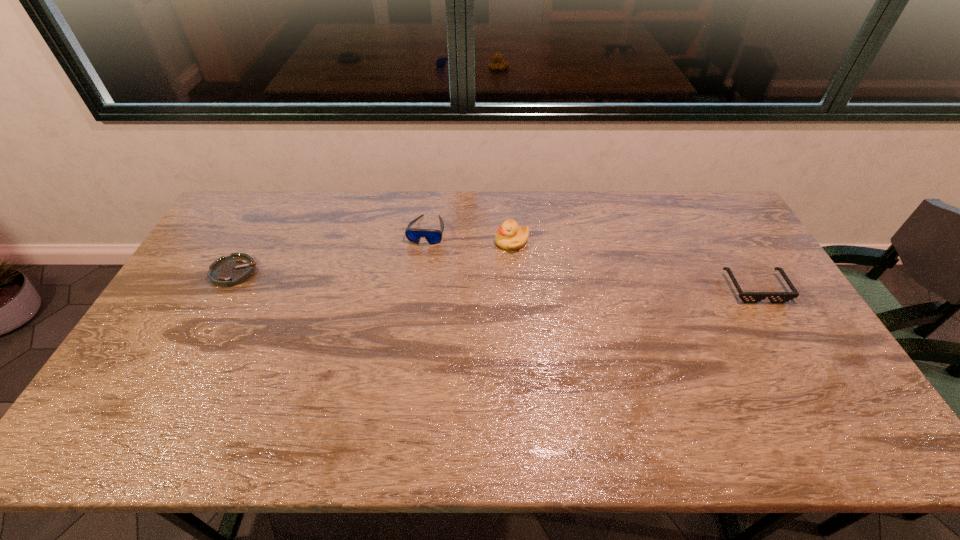
This screenshot has width=960, height=540. What are the coordinates of `vacant area between the ashtray and the right sunglasses` in the screenshot? It's located at (494, 280).

I want to click on free point between the duckling and the nearer sunglasses, so pos(634,265).

The width and height of the screenshot is (960, 540). What are the coordinates of `vacant area that lies between the right sunglasses and the shortest object` in the screenshot? It's located at (494, 280).

Find the location of a particular element. The image size is (960, 540). free space between the duckling and the farther sunglasses is located at coordinates (469, 235).

This screenshot has width=960, height=540. In order to click on free area in between the farther sunglasses and the duckling in this screenshot , I will do [469, 235].

I want to click on free space that is in between the tallest object and the shortest object, so tap(373, 256).

Locate an element on the screen. free space between the right sunglasses and the taller sunglasses is located at coordinates [x=591, y=259].

Find the location of `object that is the closest to the tallest object`. object that is the closest to the tallest object is located at coordinates (433, 236).

Select which object appears as the second closest to the tallest object. Please provide its 2D coordinates. Your answer should be formatted as a tuple, i.e. [(x, y)], where the tuple contains the x and y coordinates of a point satisfying the conditions above.

[(747, 297)]